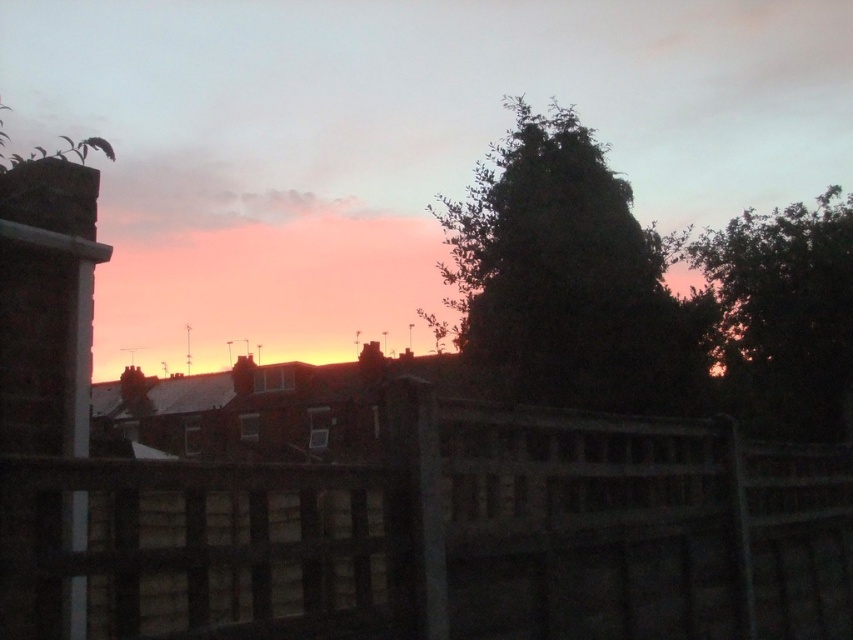
Is brown wooden fence at lower center closer to the viewer compared to dark green leafy tree at upper right?

That is True.

Can you confirm if brown wooden fence at lower center is shorter than dark green leafy tree at upper right?

Yes.

Measure the distance between brown wooden fence at lower center and camera.

brown wooden fence at lower center is 8.46 meters from camera.

The width and height of the screenshot is (853, 640). What are the coordinates of `brown wooden fence at lower center` in the screenshot? It's located at (442, 536).

Is dark green leafy tree at center taller than dark green leafy tree at upper right?

Indeed, dark green leafy tree at center has a greater height compared to dark green leafy tree at upper right.

In order to click on dark green leafy tree at center in this screenshot , I will do `click(569, 278)`.

Between point (659, 364) and point (804, 369), which one is positioned in front?

Positioned in front is point (659, 364).

I want to click on dark green leafy tree at center, so click(569, 278).

Which is more to the left, brown wooden fence at lower center or dark green leafy tree at center?

Positioned to the left is brown wooden fence at lower center.

Measure the distance between point (840,566) and camera.

Point (840,566) is 6.94 meters from camera.

The height and width of the screenshot is (640, 853). Identify the location of brown wooden fence at lower center. (442, 536).